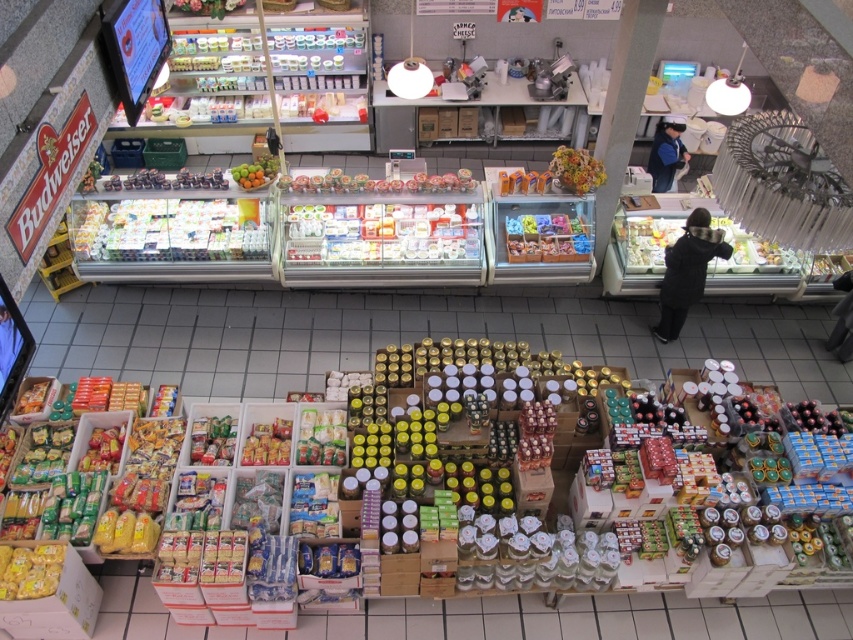
Question: Which object is closer to the camera taking this photo?

Choices:
 (A) blue fabric jacket at right
 (B) black woolen jacket at center

Answer: (B)

Question: Estimate the real-world distances between objects in this image. Which object is closer to the green matte fruit at center?

Choices:
 (A) multicolored floral arrangement at center
 (B) blue fabric jacket at right
 (C) black woolen jacket at center
 (D) translucent plastic candy at center

Answer: (D)

Question: Considering the real-world distances, which object is farthest from the black woolen jacket at center?

Choices:
 (A) translucent plastic candy at center
 (B) green matte fruit at center
 (C) blue fabric jacket at right
 (D) multicolored floral arrangement at center

Answer: (B)

Question: From the image, what is the correct spatial relationship of black woolen jacket at center in relation to multicolored floral arrangement at center?

Choices:
 (A) right
 (B) left

Answer: (A)

Question: Considering the relative positions of blue fabric jacket at right and green matte fruit at center in the image provided, where is blue fabric jacket at right located with respect to green matte fruit at center?

Choices:
 (A) above
 (B) below

Answer: (A)

Question: Is black woolen jacket at center bigger than blue fabric jacket at right?

Choices:
 (A) yes
 (B) no

Answer: (A)